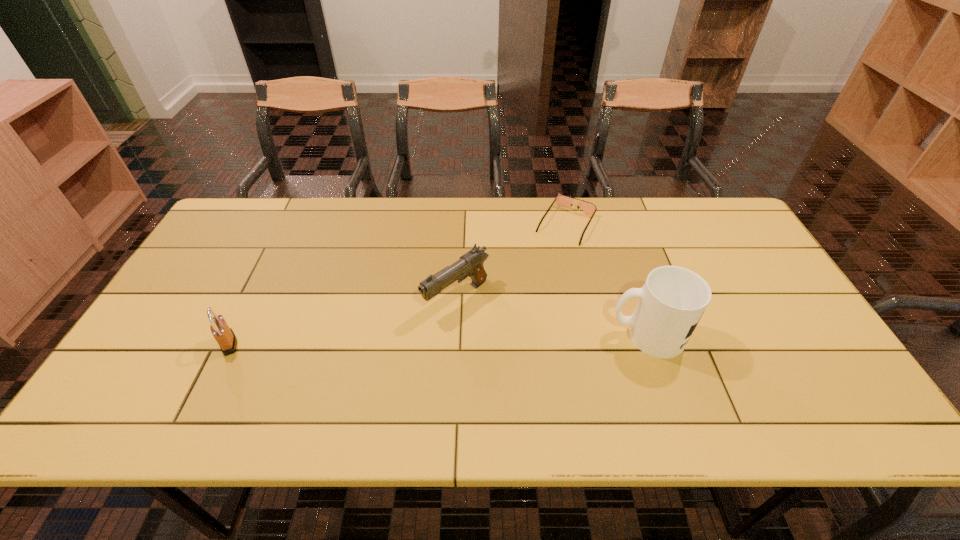
Locate an element on the screen. free region at the far left corner is located at coordinates (265, 226).

Identify the location of free area in between the tallest object and the gun. (552, 317).

Find the location of a particular element. Image resolution: width=960 pixels, height=540 pixels. vacant space in between the leftmost object and the sunglasses is located at coordinates [x=397, y=284].

Image resolution: width=960 pixels, height=540 pixels. I want to click on free space between the third object from right to left and the tallest object, so click(x=552, y=317).

In order to click on free spot between the mug and the padlock in this screenshot , I will do `click(438, 340)`.

This screenshot has width=960, height=540. In order to click on free space that is in between the sunglasses and the second object from left to right in this screenshot , I will do `click(512, 261)`.

Where is `free area in between the padlock and the gun`? This screenshot has height=540, width=960. free area in between the padlock and the gun is located at coordinates (343, 321).

At what (x,y) coordinates should I click in order to perform the action: click on vacant region between the second object from left to right and the sunglasses. Please return your answer as a coordinate pair (x, y). Looking at the image, I should click on (512, 261).

This screenshot has width=960, height=540. Find the location of `vacant space that's between the sunglasses and the padlock`. vacant space that's between the sunglasses and the padlock is located at coordinates (397, 284).

Locate an element on the screen. empty location between the shortest object and the leftmost object is located at coordinates (397, 284).